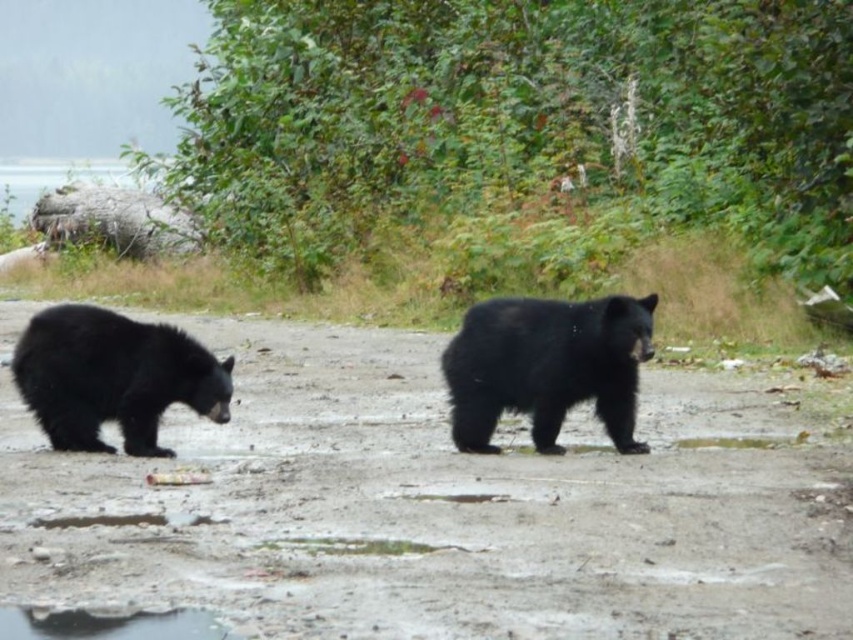
Question: Is black furry bear at center positioned before black furry bear at left?

Choices:
 (A) no
 (B) yes

Answer: (B)

Question: Among these objects, which one is nearest to the camera?

Choices:
 (A) black furry bear at left
 (B) black furry bear at center

Answer: (B)

Question: Is black furry bear at center below black furry bear at left?

Choices:
 (A) no
 (B) yes

Answer: (A)

Question: Where is black furry bear at center located in relation to black furry bear at left in the image?

Choices:
 (A) left
 (B) right

Answer: (B)